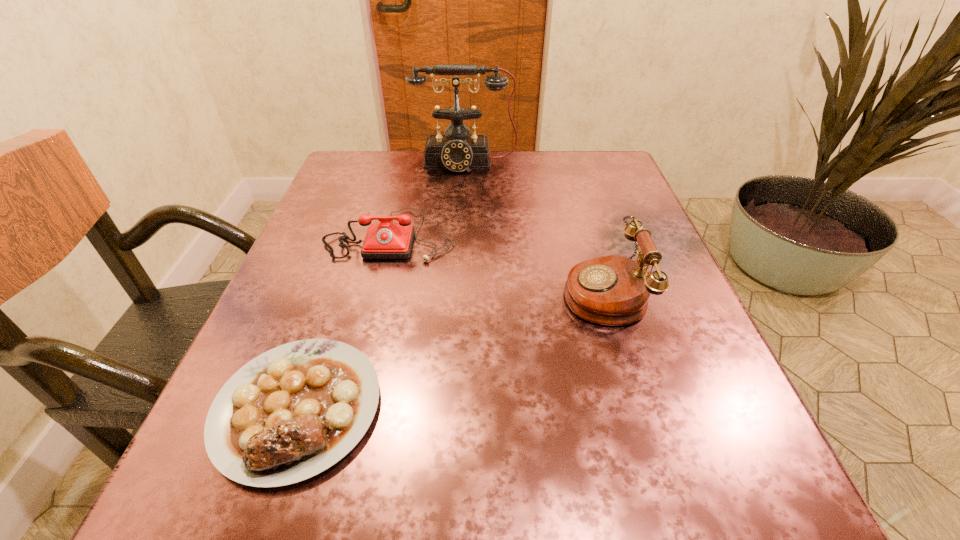
What are the coordinates of `the tallest telephone` in the screenshot? It's located at point(457,150).

Image resolution: width=960 pixels, height=540 pixels. Identify the location of the tallest object. (457, 150).

Where is `the rightmost telephone`? The image size is (960, 540). the rightmost telephone is located at coordinates (614, 290).

Image resolution: width=960 pixels, height=540 pixels. I want to click on the third shortest object, so click(614, 290).

Locate an element on the screen. This screenshot has height=540, width=960. the shortest telephone is located at coordinates (386, 240).

At what (x,y) coordinates should I click in order to perform the action: click on steak. Please return your answer as a coordinate pair (x, y). The height and width of the screenshot is (540, 960). Looking at the image, I should click on (294, 411).

Locate an element on the screen. the shortest object is located at coordinates (294, 411).

Where is `free space located on the dial of the tallest object`? The image size is (960, 540). free space located on the dial of the tallest object is located at coordinates (459, 288).

I want to click on vacant space located on the dial of the rightmost object, so click(x=395, y=291).

In order to click on free location located 0.400m on the dial of the rightmost object in this screenshot , I will do `click(330, 291)`.